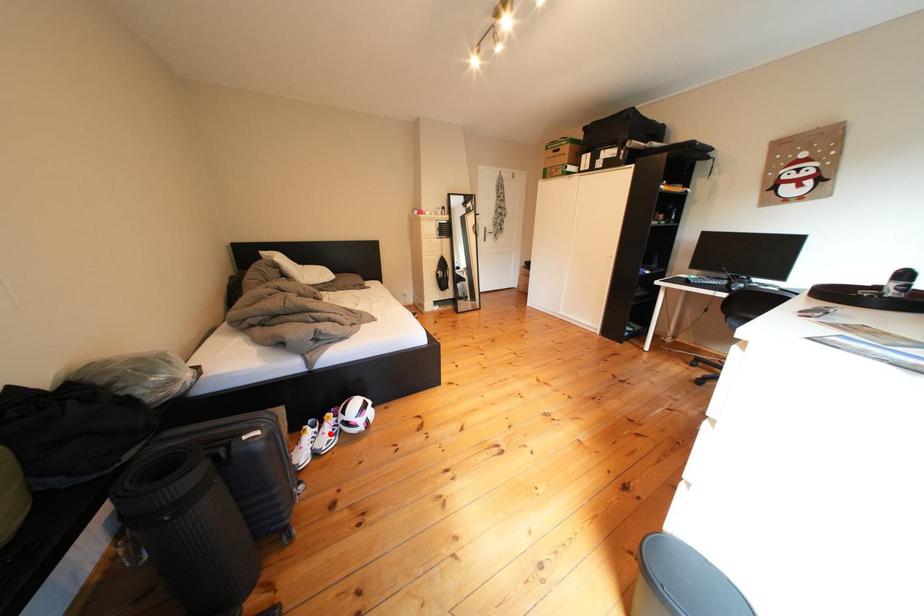
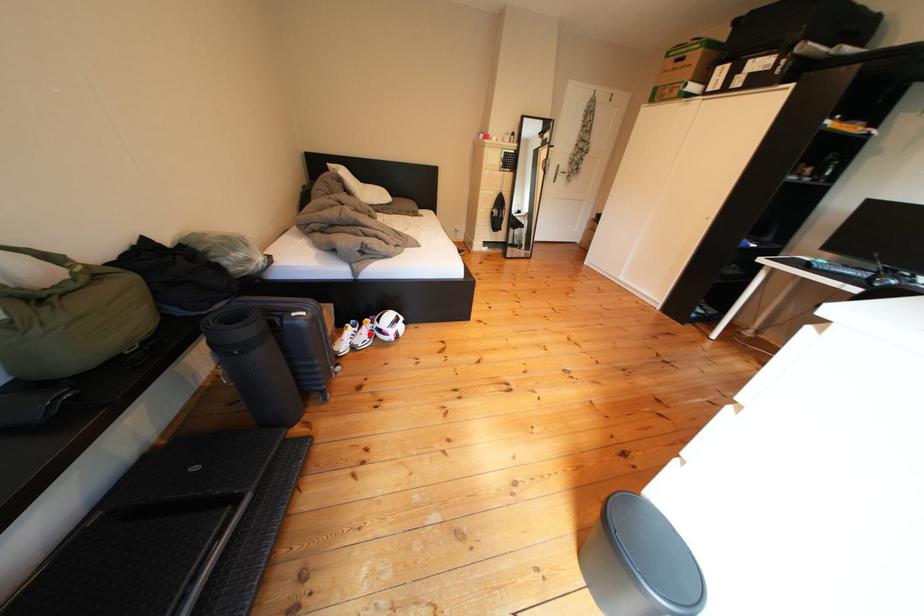
I am providing you with two images of the same scene from different viewpoints. A red point is marked on the first image and another point is marked on the second image. Is the red point in image1 aligned with the point shown in image2?

Yes